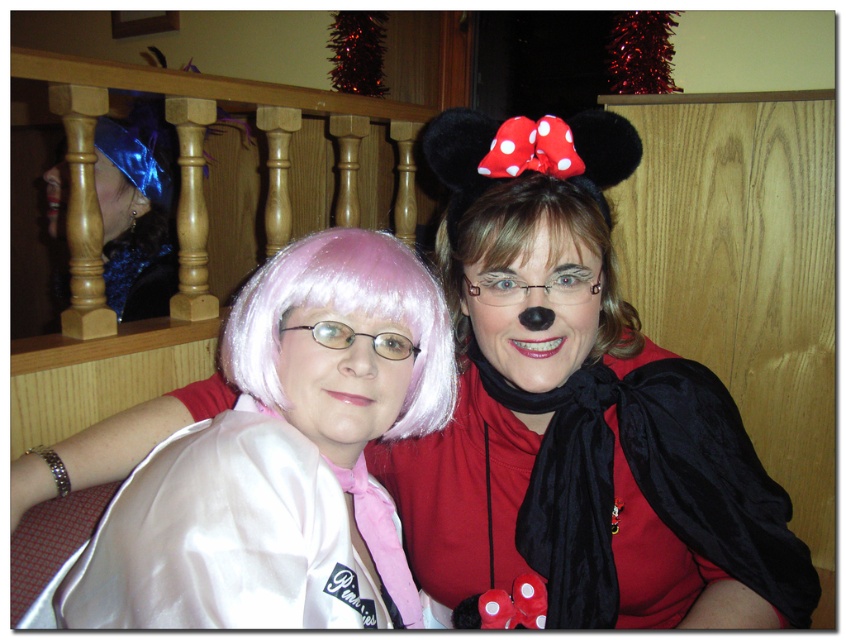
Does velvet black cape at right have a greater height compared to pink silky wig at center?

Indeed, velvet black cape at right has a greater height compared to pink silky wig at center.

Which of these two, velvet black cape at right or pink silky wig at center, stands shorter?

pink silky wig at center is shorter.

Which is behind, point (680, 445) or point (270, 378)?

The point (680, 445) is more distant.

Where is `velvet black cape at right`? This screenshot has height=640, width=846. velvet black cape at right is located at coordinates (597, 497).

Where is `velvet black cape at right`? Image resolution: width=846 pixels, height=640 pixels. velvet black cape at right is located at coordinates (x=597, y=497).

Does velvet black cape at right have a larger size compared to blonde hair at center?

Yes.

Image resolution: width=846 pixels, height=640 pixels. I want to click on velvet black cape at right, so click(597, 497).

At what (x,y) coordinates should I click in order to perform the action: click on velvet black cape at right. Please return your answer as a coordinate pair (x, y). This screenshot has width=846, height=640. Looking at the image, I should click on (597, 497).

Between blue satin wig at upper left and blonde hair at center, which one appears on the right side from the viewer's perspective?

blonde hair at center is more to the right.

Is blue satin wig at upper left shorter than blonde hair at center?

No.

Does point (169, 273) come farther from viewer compared to point (608, 218)?

Yes.

Locate an element on the screen. Image resolution: width=846 pixels, height=640 pixels. blue satin wig at upper left is located at coordinates (136, 211).